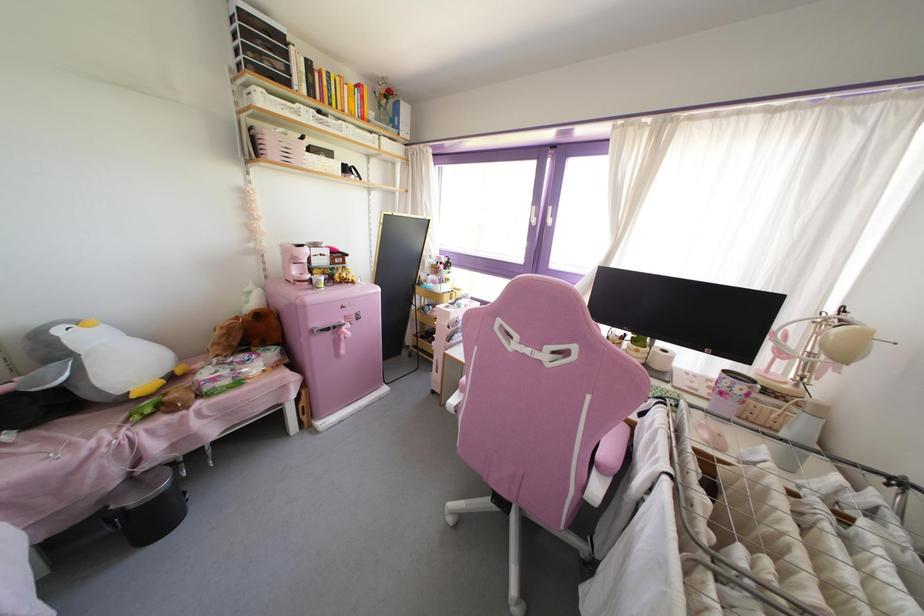
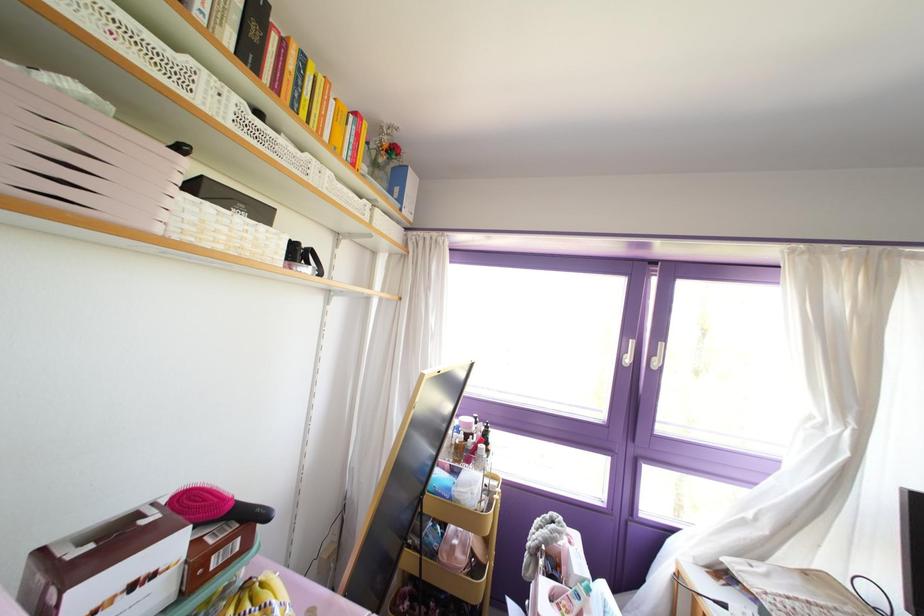
In the second image, find the point that corresponds to (380,105) in the first image.

(372, 163)